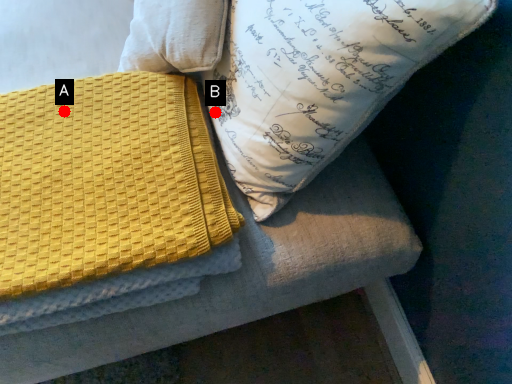
Question: Two points are circled on the image, labeled by A and B beside each circle. Which point is farther from the camera taking this photo?

Choices:
 (A) A is further
 (B) B is further

Answer: (B)